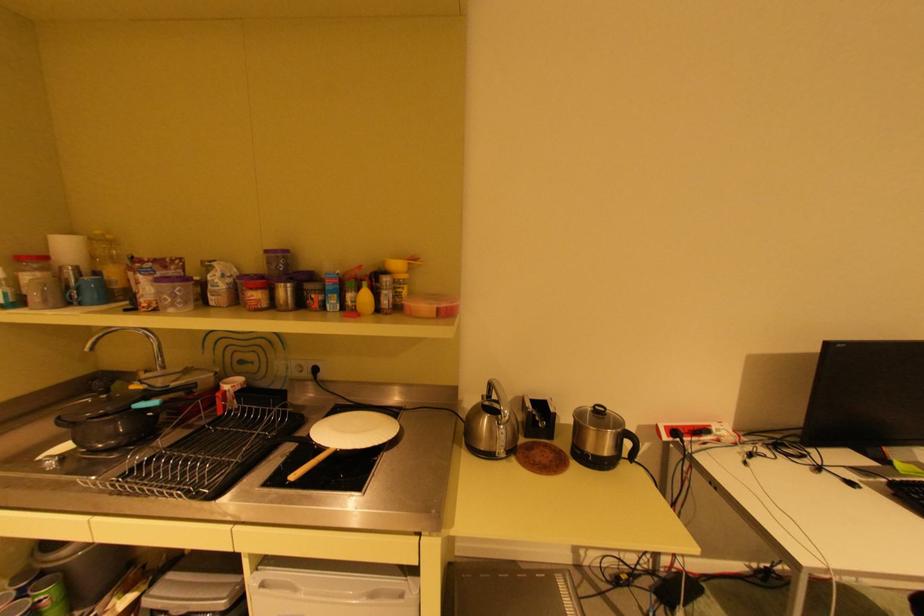
Find where to lift the black pot lid handle. Please return your answer as a coordinate pair (x, y).

(147, 405)